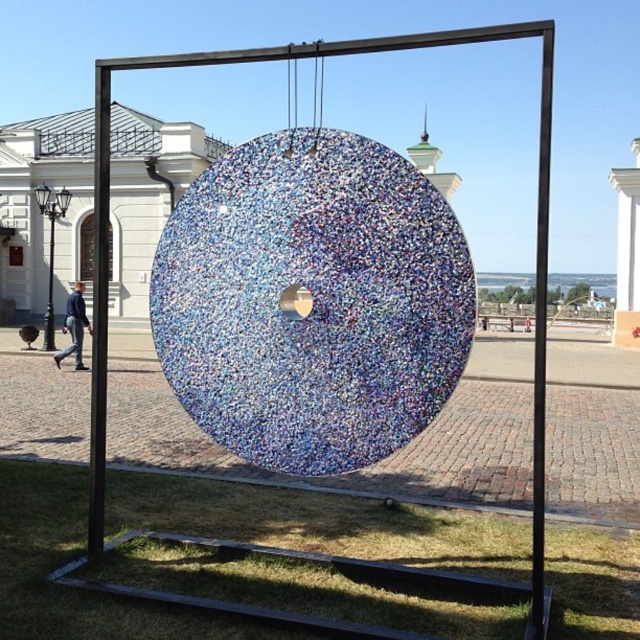
Question: Where is black metal pole at left located in relation to blue denim jacket at lower left in the image?

Choices:
 (A) below
 (B) above

Answer: (B)

Question: Which object is the closest to the blue denim jacket at lower left?

Choices:
 (A) translucent mosaic circle at center
 (B) black metal pole at left

Answer: (B)

Question: Does translucent mosaic circle at center lie in front of black metal pole at left?

Choices:
 (A) yes
 (B) no

Answer: (A)

Question: Which point appears closest to the camera in this image?

Choices:
 (A) (77, 310)
 (B) (100, 531)

Answer: (B)

Question: Which is farther from the blue denim jacket at lower left?

Choices:
 (A) translucent mosaic circle at center
 (B) black metal pole at left

Answer: (A)

Question: Is black metal pole at left above blue denim jacket at lower left?

Choices:
 (A) yes
 (B) no

Answer: (A)